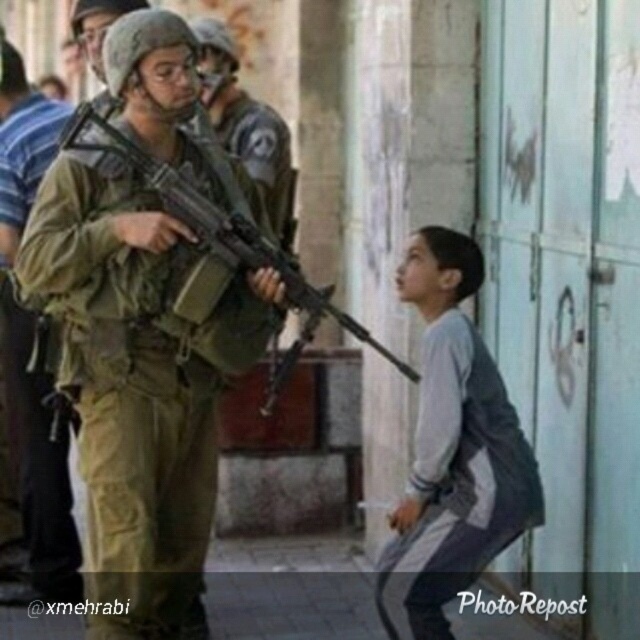
Question: Which point is closer to the camera?

Choices:
 (A) (458, 385)
 (B) (74, 552)

Answer: (A)

Question: In this image, where is gray fabric pants at lower right located relative to camouflage uniform at center?

Choices:
 (A) left
 (B) right

Answer: (B)

Question: Which of the following is the farthest from the observer?

Choices:
 (A) (435, 406)
 (B) (323, 312)

Answer: (B)

Question: Is gray fabric pants at lower right positioned before camouflage uniform at center?

Choices:
 (A) yes
 (B) no

Answer: (A)

Question: Can you confirm if camouflage uniform at center is positioned above matte black rifle at center?

Choices:
 (A) yes
 (B) no

Answer: (B)

Question: Which point is farther to the camera?

Choices:
 (A) (99, 440)
 (B) (204, 200)
 (C) (40, 118)

Answer: (C)